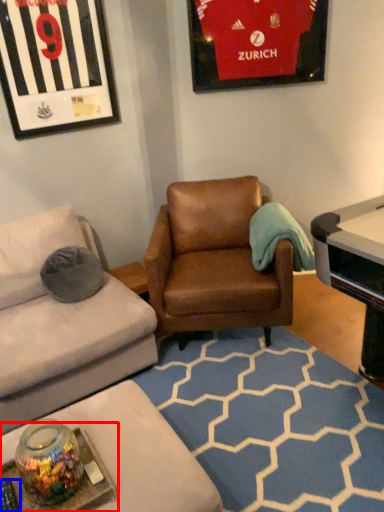
Question: Which point is further to the camera, round table (highlighted by a red box) or remote control (highlighted by a blue box)?

Choices:
 (A) round table
 (B) remote control

Answer: (B)